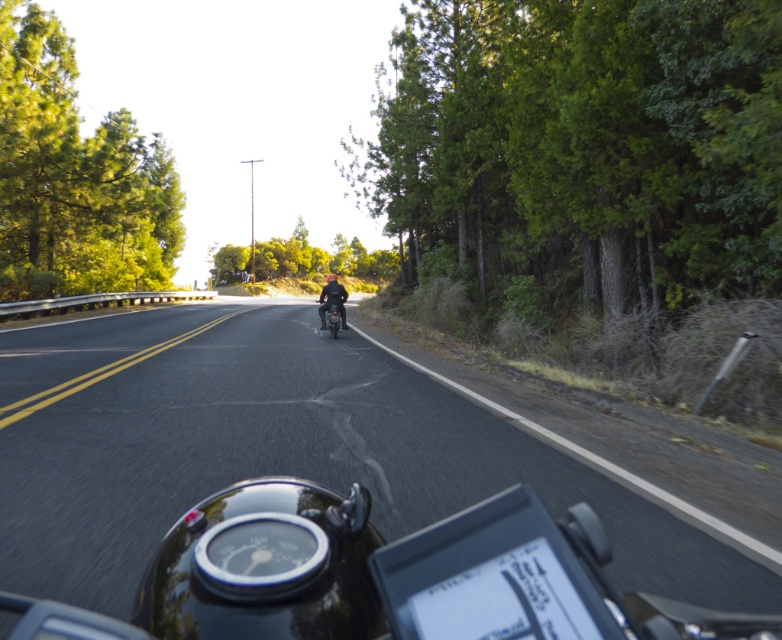
You are riding a motorcycle and see the green leafy tree at left and the shiny black motorcycle at center. Which object is wider from your perspective?

The green leafy tree at left is wider than the shiny black motorcycle at center according to the description.

You are a motorcyclist on a two lane road surrounded by dense greenery. You see a black asphalt road at center at point (273, 460). Is the road at that point part of the lane you are currently riding in?

The black asphalt road at center at point (273, 460) is part of the lane you are currently riding in since the road is straight ahead and centered in your view.

You are a motorcyclist riding on the black asphalt road at center. You notice a green leafy tree at center ahead of you. Which object will you pass first?

The black asphalt road at center is thinner than green leafy tree at center, so you will pass the black asphalt road at center first because it is narrower and positioned along your path.